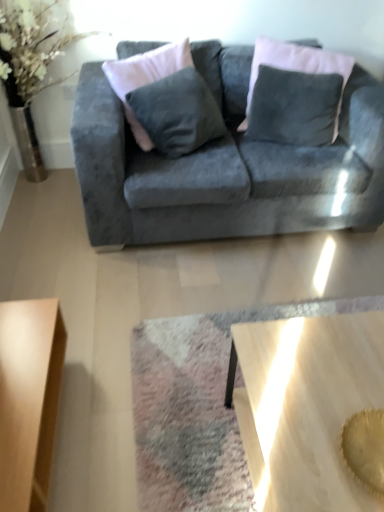
Find the location of a particular element. This screenshot has width=384, height=512. vacant space in between velvet gray couch at center and light brown wooden coffee table at lower left, the first coffee table viewed from the left is located at coordinates (172, 312).